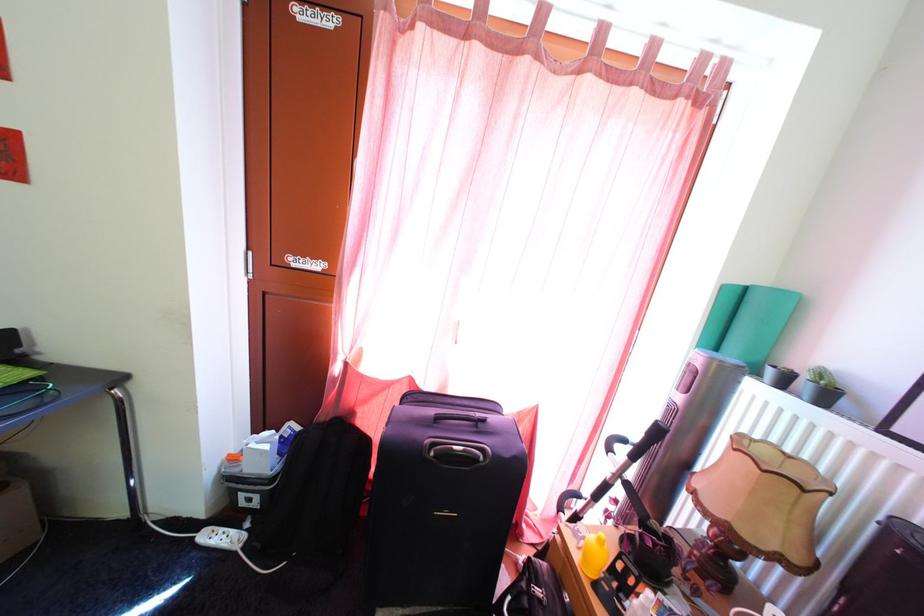
Which object does [221,538] point to?

It refers to a white power strip.